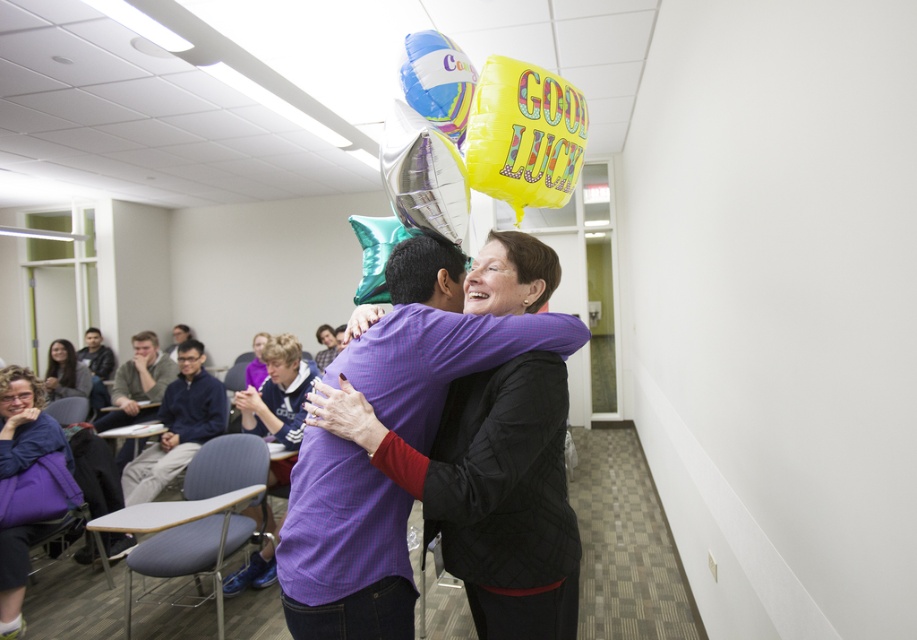
Question: Which point is farther to the camera?

Choices:
 (A) yellow metallic balloon at upper center
 (B) purple matte shirt at center
 (C) smooth skin face at center
 (D) matte black head at center

Answer: (C)

Question: Can you confirm if shiny metallic balloon at upper center is smaller than purple matte shirt at center?

Choices:
 (A) no
 (B) yes

Answer: (A)

Question: Which object is the farthest from the dark blue sweater at center?

Choices:
 (A) yellow metallic balloon at upper center
 (B) blue cotton shirt at left

Answer: (A)

Question: Can you confirm if shiny metallic balloon at upper center is wider than matte black head at upper left?

Choices:
 (A) yes
 (B) no

Answer: (B)

Question: Which object is the farthest from the matte black head at center?

Choices:
 (A) matte black hair at center
 (B) smooth blue hair at center
 (C) shiny metallic balloon at upper center
 (D) yellow metallic balloon at upper center

Answer: (A)

Question: Is blue cotton shirt at left to the right of matte purple sweater at center from the viewer's perspective?

Choices:
 (A) no
 (B) yes

Answer: (B)